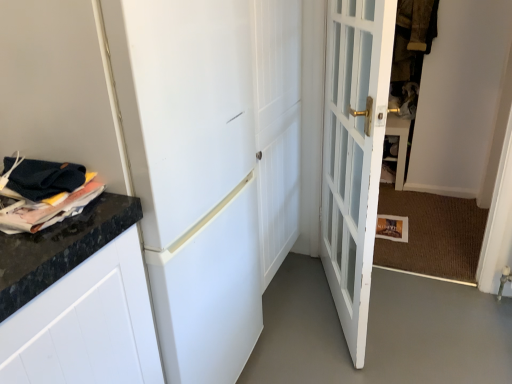
Question: Looking at the image, does white glossy door at center, positioned as the 1th door in left-to-right order, seem bigger or smaller compared to matte black magazine at left?

Choices:
 (A) big
 (B) small

Answer: (A)

Question: From the image's perspective, is white glossy door at center, positioned as the 1th door in left-to-right order, located above or below matte black magazine at left?

Choices:
 (A) above
 (B) below

Answer: (B)

Question: Which object is the closest to the brown textured fabric at upper right?

Choices:
 (A) white glossy door at center, which is counted as the second door, starting from the right
 (B) matte black magazine at left
 (C) white glass door at center, which is the 2th door in left-to-right order

Answer: (C)

Question: Estimate the real-world distances between objects in this image. Which object is closer to the brown textured fabric at upper right?

Choices:
 (A) white glossy door at center, positioned as the 1th door in left-to-right order
 (B) matte black magazine at left
 (C) white glass door at center, which is the 2th door in left-to-right order

Answer: (C)